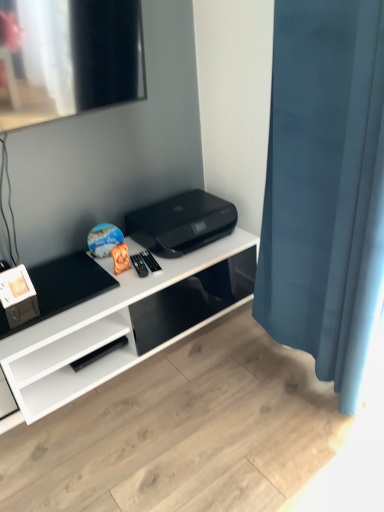
This screenshot has width=384, height=512. Find the location of `free location in front of blue velvet curtain at right`. free location in front of blue velvet curtain at right is located at coordinates (291, 440).